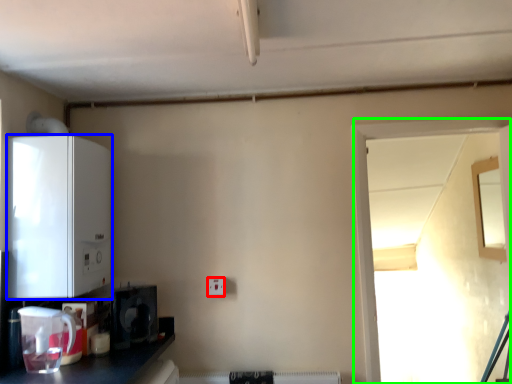
Question: Which object is positioned closest to electric outlet (highlighted by a red box)? Select from appliance (highlighted by a blue box) and window (highlighted by a green box).

Choices:
 (A) appliance
 (B) window

Answer: (A)